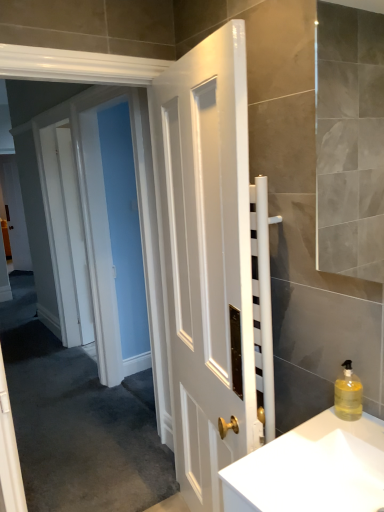
Question: From the image's perspective, would you say white glossy sink at lower right is positioned over white glossy door at left?

Choices:
 (A) yes
 (B) no

Answer: (B)

Question: Does white glossy sink at lower right have a greater height compared to white glossy door at left?

Choices:
 (A) yes
 (B) no

Answer: (B)

Question: Can you confirm if white glossy sink at lower right is shorter than white glossy door at left?

Choices:
 (A) no
 (B) yes

Answer: (B)

Question: Can you confirm if white glossy sink at lower right is bigger than white glossy door at left?

Choices:
 (A) no
 (B) yes

Answer: (A)

Question: Considering the relative sizes of white glossy sink at lower right and white glossy door at left in the image provided, is white glossy sink at lower right smaller than white glossy door at left?

Choices:
 (A) no
 (B) yes

Answer: (B)

Question: Would you say white glossy sink at lower right is outside white glossy door at left?

Choices:
 (A) no
 (B) yes

Answer: (B)

Question: Is white glossy door at left looking in the opposite direction of white glossy sink at lower right?

Choices:
 (A) no
 (B) yes

Answer: (A)

Question: Is white glossy door at left placed right next to white glossy sink at lower right?

Choices:
 (A) no
 (B) yes

Answer: (A)

Question: Can you confirm if white glossy door at left is bigger than white glossy sink at lower right?

Choices:
 (A) no
 (B) yes

Answer: (B)

Question: Considering the relative sizes of white glossy door at left and white glossy sink at lower right in the image provided, is white glossy door at left taller than white glossy sink at lower right?

Choices:
 (A) yes
 (B) no

Answer: (A)

Question: Could you tell me if white glossy door at left is facing white glossy sink at lower right?

Choices:
 (A) yes
 (B) no

Answer: (A)

Question: Would you say white glossy door at left is outside white glossy sink at lower right?

Choices:
 (A) no
 (B) yes

Answer: (B)

Question: Can you confirm if translucent yellow liquid at right is wider than white glossy sink at lower right?

Choices:
 (A) yes
 (B) no

Answer: (B)